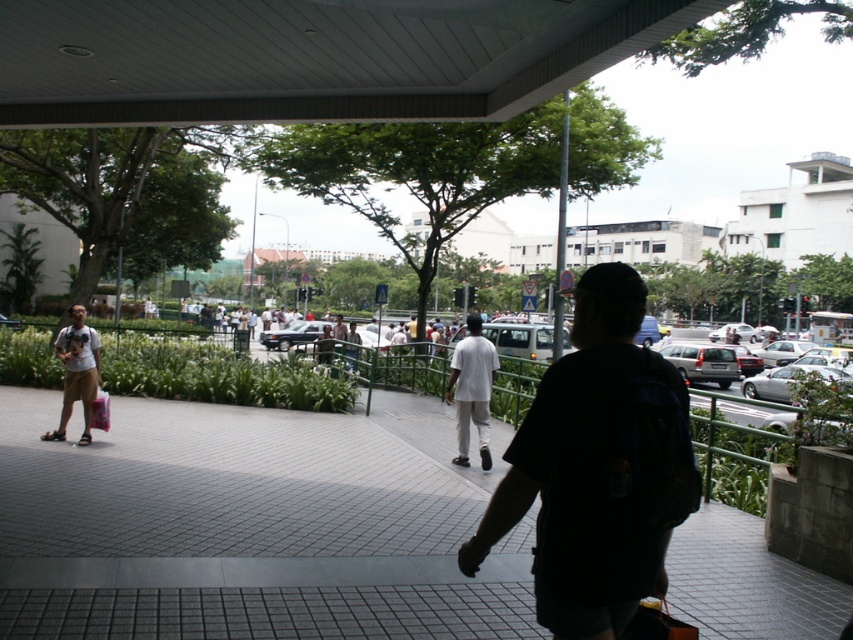
Question: Which point is farther to the camera?

Choices:
 (A) gray concrete pavement at center
 (B) white cotton shirt at left
 (C) dark blue backpack at center

Answer: (B)

Question: Among these objects, which one is farthest from the camera?

Choices:
 (A) dark blue backpack at center
 (B) white matte pants at center
 (C) gray concrete pavement at center
 (D) white cotton shirt at left

Answer: (D)

Question: Observing the image, what is the correct spatial positioning of dark blue backpack at center in reference to white matte pants at center?

Choices:
 (A) right
 (B) left

Answer: (B)

Question: Does gray concrete pavement at center lie behind white cotton shirt at left?

Choices:
 (A) no
 (B) yes

Answer: (A)

Question: Which point is farther to the camera?

Choices:
 (A) white matte pants at center
 (B) dark blue backpack at center

Answer: (A)

Question: Where is gray concrete pavement at center located in relation to dark blue backpack at center in the image?

Choices:
 (A) right
 (B) left

Answer: (B)